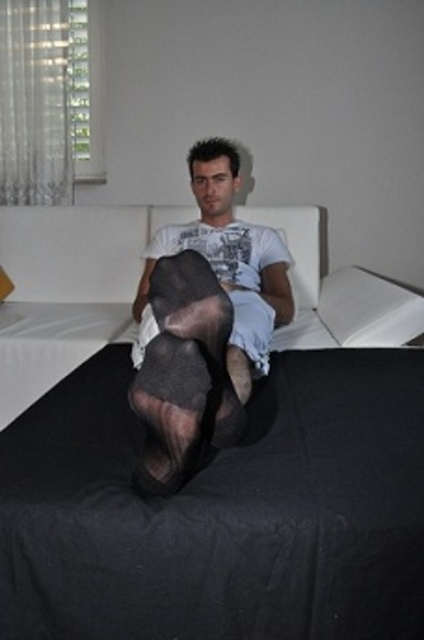
Does matte black tights at center have a larger size compared to black sheer stocking at center?

Correct, matte black tights at center is larger in size than black sheer stocking at center.

Identify the location of matte black tights at center. (204, 321).

Based on the photo, between black fabric bed at center and black sheer stocking at center, which one appears on the right side from the viewer's perspective?

black fabric bed at center is more to the right.

Who is shorter, black fabric bed at center or black sheer stocking at center?

black sheer stocking at center

Is point (195, 577) less distant than point (201, 424)?

Yes, point (195, 577) is closer to viewer.

You are a GUI agent. You are given a task and a screenshot of the screen. Output one action in this format:
    pyautogui.click(x=<x>, y=<y>)
    Task: Click on the black fabric bed at center
    The image size is (424, 640).
    Given the screenshot: What is the action you would take?
    pyautogui.click(x=212, y=461)

Which is in front, point (203, 381) or point (410, 314)?

Point (203, 381) is in front.

Who is positioned more to the left, black sheer stocking at center or white fabric pillow at upper right?

black sheer stocking at center

Image resolution: width=424 pixels, height=640 pixels. Describe the element at coordinates (184, 372) in the screenshot. I see `black sheer stocking at center` at that location.

Where is `black sheer stocking at center`? black sheer stocking at center is located at coordinates (184, 372).